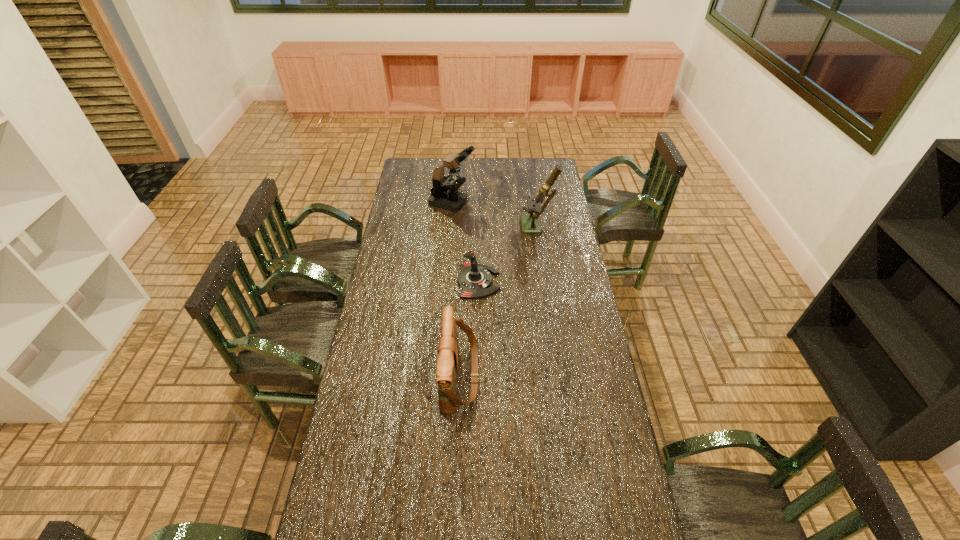
You are a GUI agent. You are given a task and a screenshot of the screen. Output one action in this format:
    pyautogui.click(x=<x>, y=<y>)
    Task: Click on the free space between the joystick and the nearer microscope
    
    Given the screenshot: What is the action you would take?
    pyautogui.click(x=508, y=255)

You are a GUI agent. You are given a task and a screenshot of the screen. Output one action in this format:
    pyautogui.click(x=<x>, y=<y>)
    Task: Click on the vacant space that's between the second farthest object and the farther microscope
    This screenshot has width=960, height=540.
    Given the screenshot: What is the action you would take?
    pyautogui.click(x=495, y=215)

Identify the location of free space that is in between the right microscope and the farthest object. This screenshot has height=540, width=960. (495, 215).

Where is `object that stands as the third closest to the rightmost object`? object that stands as the third closest to the rightmost object is located at coordinates (447, 363).

The height and width of the screenshot is (540, 960). Find the location of `object identified as the third closest to the nearest object`. object identified as the third closest to the nearest object is located at coordinates (444, 194).